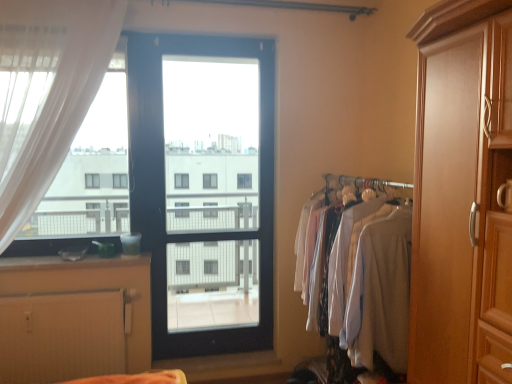
You are a GUI agent. You are given a task and a screenshot of the screen. Output one action in this format:
    pyautogui.click(x=<x>, y=<y>)
    Task: Click on the black glass door at center
    The height and width of the screenshot is (384, 512).
    Given the screenshot: What is the action you would take?
    pyautogui.click(x=204, y=188)

This screenshot has height=384, width=512. What do you see at coordinates (204, 188) in the screenshot?
I see `black glass door at center` at bounding box center [204, 188].

Describe the element at coordinates (461, 195) in the screenshot. I see `wooden wardrobe at right` at that location.

Locate an element on the screen. This screenshot has width=512, height=384. white sheer curtain at left is located at coordinates (60, 112).

From a real-world perspective, which is physically above, wooden wardrobe at right or white textured radiator at lower left?

From a 3D spatial view, wooden wardrobe at right is above.

Is wooden wardrobe at right bigger or smaller than white textured radiator at lower left?

Clearly, wooden wardrobe at right is larger in size than white textured radiator at lower left.

Considering the sizes of wooden wardrobe at right and white textured radiator at lower left in the image, is wooden wardrobe at right taller or shorter than white textured radiator at lower left?

In the image, wooden wardrobe at right appears to be taller than white textured radiator at lower left.

Does point (429, 275) lie in front of point (49, 324)?

Yes, point (429, 275) is closer to viewer.

Considering the relative positions of white textured radiator at lower left and light gray fabric shirts at right in the image provided, is white textured radiator at lower left to the right of light gray fabric shirts at right from the viewer's perspective?

In fact, white textured radiator at lower left is to the left of light gray fabric shirts at right.

Who is taller, white textured radiator at lower left or light gray fabric shirts at right?

Standing taller between the two is light gray fabric shirts at right.

Which of these two, white textured radiator at lower left or light gray fabric shirts at right, is bigger?

With larger size is light gray fabric shirts at right.

Which object is positioned more to the left, wooden wardrobe at right or white sheer curtain at left?

white sheer curtain at left.

Is wooden wardrobe at right spatially inside white sheer curtain at left, or outside of it?

wooden wardrobe at right is not inside white sheer curtain at left, it's outside.

Does wooden wardrobe at right turn towards white sheer curtain at left?

No.

Is the position of wooden wardrobe at right less distant than that of white sheer curtain at left?

Yes, it is in front of white sheer curtain at left.

Does wooden wardrobe at right have a larger size compared to black glass door at center?

Yes.

Which object is closer to the camera taking this photo, wooden wardrobe at right or black glass door at center?

wooden wardrobe at right.

Is wooden wardrobe at right oriented away from black glass door at center?

No, wooden wardrobe at right's orientation is not away from black glass door at center.

From a real-world perspective, which object rests below the other?

black glass door at center, from a real-world perspective.

Are black glass door at center and white textured radiator at lower left located far from each other?

That's right, there is a large distance between black glass door at center and white textured radiator at lower left.

In the scene shown: From the image's perspective, who appears lower, black glass door at center or white textured radiator at lower left?

white textured radiator at lower left, from the image's perspective.

Which object is further away from the camera taking this photo, black glass door at center or white textured radiator at lower left?

black glass door at center.

Based on the photo, considering the relative sizes of black glass door at center and white textured radiator at lower left in the image provided, is black glass door at center thinner than white textured radiator at lower left?

Correct, the width of black glass door at center is less than that of white textured radiator at lower left.

Where is `radiator below the smooth wooden surface at lower left (from the image's perspective)`? This screenshot has width=512, height=384. radiator below the smooth wooden surface at lower left (from the image's perspective) is located at coordinates (61, 336).

Measure the distance between white textured radiator at lower left and smooth wooden surface at lower left.

A distance of 15.00 inches exists between white textured radiator at lower left and smooth wooden surface at lower left.

Does white textured radiator at lower left appear on the left side of smooth wooden surface at lower left?

In fact, white textured radiator at lower left is to the right of smooth wooden surface at lower left.

In the scene shown: From a real-world perspective, is white textured radiator at lower left positioned over smooth wooden surface at lower left based on gravity?

No, from a real-world perspective, white textured radiator at lower left is not above smooth wooden surface at lower left.

This screenshot has width=512, height=384. Find the location of `laundry in front of the smooth wooden surface at lower left`. laundry in front of the smooth wooden surface at lower left is located at coordinates (345, 253).

Is point (324, 314) closer or farther from the camera than point (8, 270)?

Point (324, 314).

From a real-world perspective, between light gray fabric shirts at right and smooth wooden surface at lower left, who is vertically higher?

From a 3D spatial view, smooth wooden surface at lower left is above.

Where is `radiator that appears behind the wooden wardrobe at right`? The height and width of the screenshot is (384, 512). radiator that appears behind the wooden wardrobe at right is located at coordinates (61, 336).

Where is `laundry lying in front of the white textured radiator at lower left`? Image resolution: width=512 pixels, height=384 pixels. laundry lying in front of the white textured radiator at lower left is located at coordinates (345, 253).

Estimate the real-world distances between objects in this image. Which object is closer to white textured radiator at lower left, wooden wardrobe at right or smooth wooden surface at lower left?

Among the two, smooth wooden surface at lower left is located nearer to white textured radiator at lower left.

Looking at the image, which one is located further to white sheer curtain at left, smooth wooden surface at lower left or white textured radiator at lower left?

white textured radiator at lower left.

Which object lies nearer to the anchor point white textured radiator at lower left, light gray fabric shirts at right or black glass door at center?

The object closer to white textured radiator at lower left is light gray fabric shirts at right.

Which object lies nearer to the anchor point smooth wooden surface at lower left, wooden wardrobe at right or white sheer curtain at left?

Based on the image, white sheer curtain at left appears to be nearer to smooth wooden surface at lower left.

Looking at the image, which one is located further to white textured radiator at lower left, smooth wooden surface at lower left or white sheer curtain at left?

white sheer curtain at left.

Which object lies nearer to the anchor point white sheer curtain at left, white textured radiator at lower left or wooden wardrobe at right?

white textured radiator at lower left is positioned closer to the anchor white sheer curtain at left.

When comparing their distances from black glass door at center, does white textured radiator at lower left or smooth wooden surface at lower left seem closer?

The object closer to black glass door at center is white textured radiator at lower left.

Considering their positions, is black glass door at center positioned closer to white sheer curtain at left than smooth wooden surface at lower left?

smooth wooden surface at lower left lies closer to white sheer curtain at left than the other object.

In order to click on window sill between wooden wardrobe at right and black glass door at center along the z-axis in this screenshot , I will do `click(70, 262)`.

Locate an element on the screen. The height and width of the screenshot is (384, 512). door between smooth wooden surface at lower left and light gray fabric shirts at right is located at coordinates (204, 188).

Where is `laundry between white textured radiator at lower left and wooden wardrobe at right in the horizontal direction`? This screenshot has width=512, height=384. laundry between white textured radiator at lower left and wooden wardrobe at right in the horizontal direction is located at coordinates click(345, 253).

This screenshot has height=384, width=512. Find the location of `radiator between smooth wooden surface at lower left and wooden wardrobe at right in the horizontal direction`. radiator between smooth wooden surface at lower left and wooden wardrobe at right in the horizontal direction is located at coordinates (61, 336).